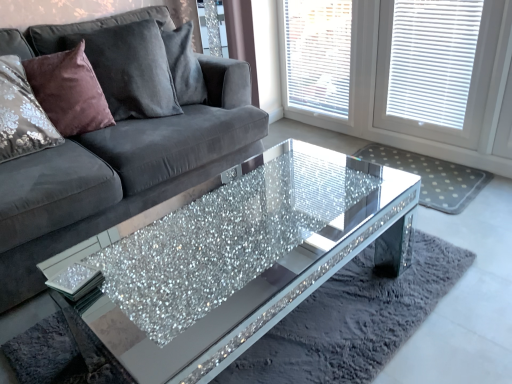
Question: From the image's perspective, is velvet grey couch at center positioned above or below white textured blinds at upper right?

Choices:
 (A) below
 (B) above

Answer: (A)

Question: Is velvet grey couch at center bigger or smaller than white textured blinds at upper right?

Choices:
 (A) small
 (B) big

Answer: (B)

Question: Which object is the farthest from the white textured blinds at upper right?

Choices:
 (A) white mesh screen at upper right
 (B) sparkly glass coffee table at center
 (C) velvet/maroon pillow at upper left, the 2th pillow in the right-to-left sequence
 (D) white dotted mat at center
 (E) velvet grey couch at center

Answer: (C)

Question: Which of these objects is positioned farthest from the white dotted mat at center?

Choices:
 (A) velvet grey couch at center
 (B) velvet/maroon pillow at left, the 2th pillow viewed from the left
 (C) velvet/maroon pillow at upper left, marked as the first pillow in a left-to-right arrangement
 (D) sparkly glass coffee table at center
 (E) white textured blinds at upper right

Answer: (C)